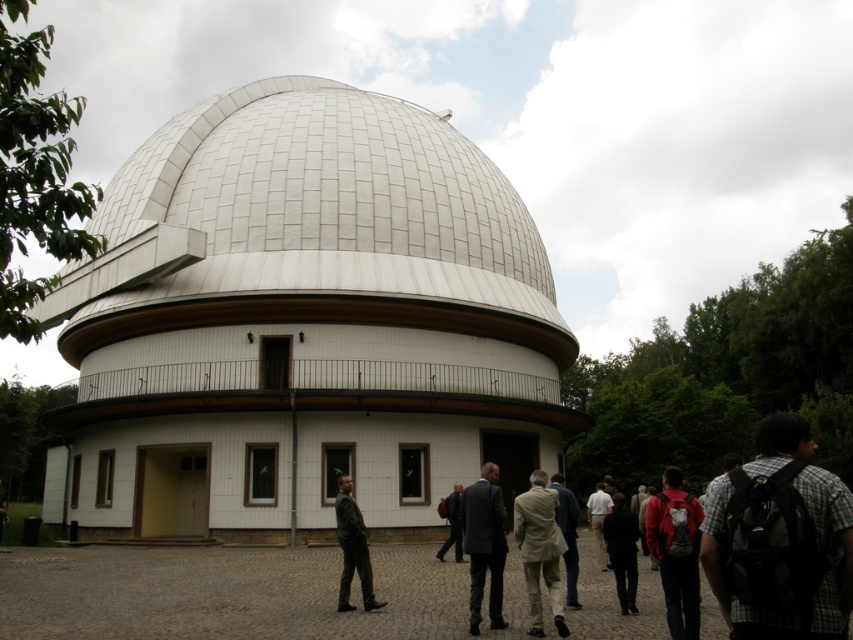
Does plaid shirt backpack at lower right appear on the left side of red backpack at lower right?

Yes, plaid shirt backpack at lower right is to the left of red backpack at lower right.

Is plaid shirt backpack at lower right thinner than red backpack at lower right?

Indeed, plaid shirt backpack at lower right has a lesser width compared to red backpack at lower right.

I want to click on plaid shirt backpack at lower right, so click(780, 540).

Between point (343, 596) and point (604, 500), which one is positioned behind?

Positioned behind is point (604, 500).

Based on the photo, is dark brown leather jacket at center closer to the viewer compared to white cotton shirt at center?

Yes.

Which is in front, point (357, 564) or point (601, 493)?

Point (357, 564)

Where is `dark brown leather jacket at center`? The image size is (853, 640). dark brown leather jacket at center is located at coordinates (352, 547).

Is white matte observatory at center above light beige fabric coat at center?

Yes, white matte observatory at center is above light beige fabric coat at center.

This screenshot has height=640, width=853. What are the coordinates of `white matte observatory at center` in the screenshot? It's located at (302, 323).